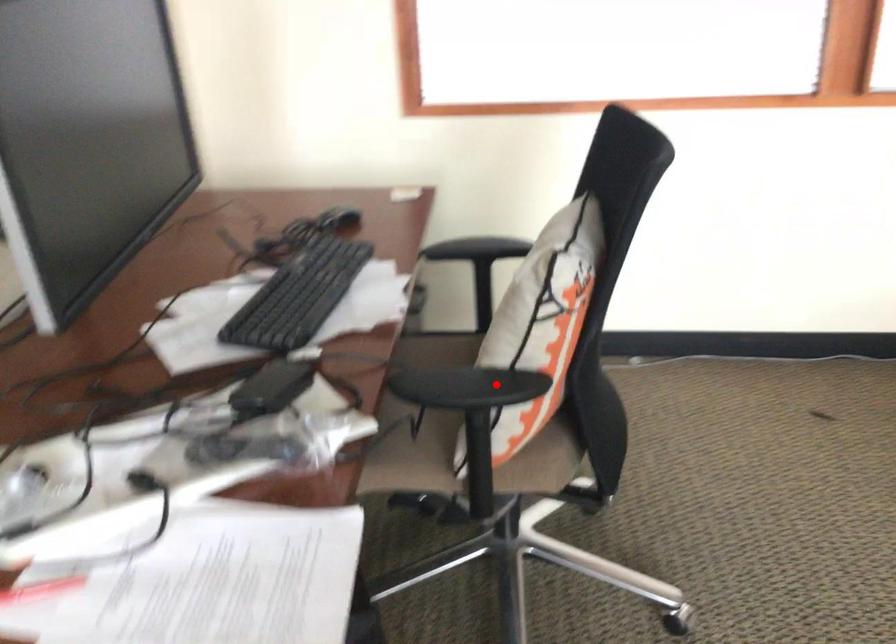
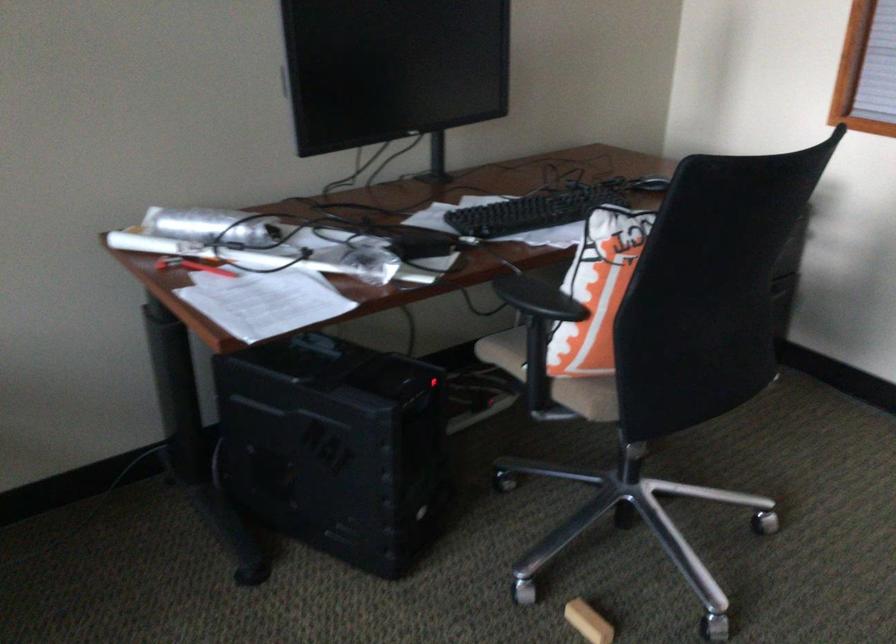
In the second image, find the point that corresponds to the highlighted location in the first image.

(538, 299)